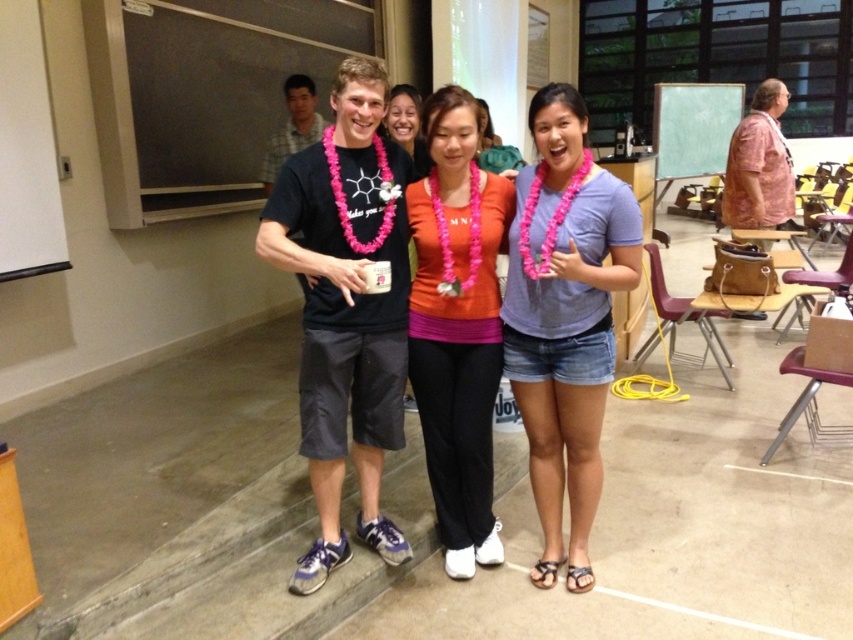
Is denim shorts at center below light brown plaid shirt at center?

Correct, denim shorts at center is located below light brown plaid shirt at center.

Does point (527, 218) come behind point (265, 173)?

No, (527, 218) is in front of (265, 173).

Between point (582, 445) and point (285, 100), which one is positioned behind?

Point (285, 100)

The width and height of the screenshot is (853, 640). Find the location of `denim shorts at center`. denim shorts at center is located at coordinates (566, 320).

Based on the photo, which is more to the left, dark gray shorts at center or light brown plaid shirt at center?

light brown plaid shirt at center is more to the left.

Who is higher up, dark gray shorts at center or light brown plaid shirt at center?

light brown plaid shirt at center is above.

Does point (368, 74) come behind point (271, 163)?

No, (368, 74) is in front of (271, 163).

At what (x,y) coordinates should I click in order to perform the action: click on dark gray shorts at center. Please return your answer as a coordinate pair (x, y). The height and width of the screenshot is (640, 853). Looking at the image, I should click on (346, 308).

Is point (508, 211) behind point (408, 88)?

No, (508, 211) is closer to viewer.

Which is behind, point (473, 221) or point (416, 148)?

Point (416, 148)

This screenshot has height=640, width=853. I want to click on orange fabric shirt at center, so click(457, 324).